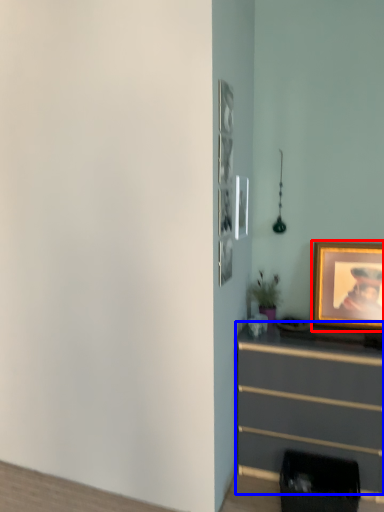
Question: Which object is closer to the camera taking this photo, picture frame (highlighted by a red box) or chest of drawers (highlighted by a blue box)?

Choices:
 (A) picture frame
 (B) chest of drawers

Answer: (B)